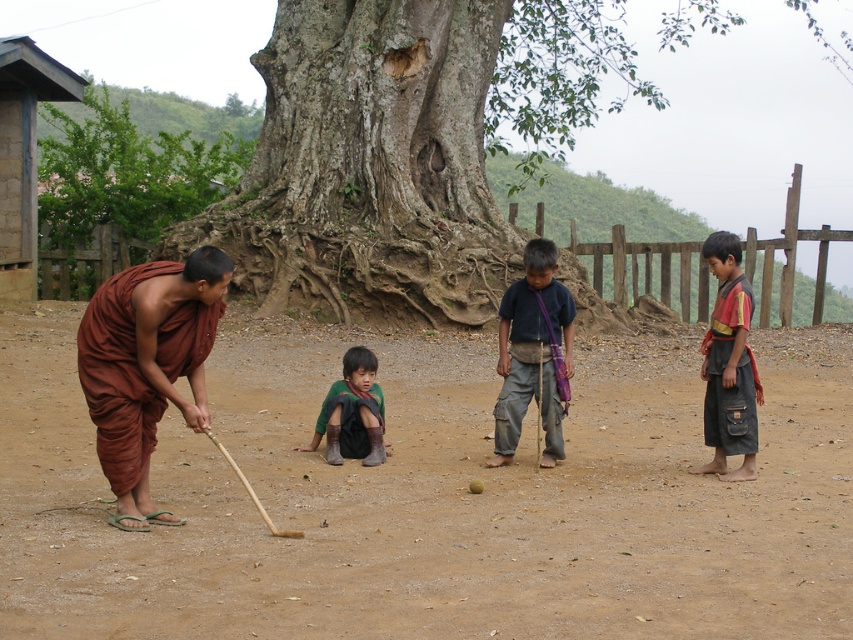
Question: Considering the real-world distances, which object is farthest from the green leafy tree at upper left?

Choices:
 (A) brown dirt field at center
 (B) dark green fabric at center

Answer: (B)

Question: Does green rough bark tree at center come in front of dark blue cotton shirt at center?

Choices:
 (A) yes
 (B) no

Answer: (B)

Question: Which is farther from the reddish-brown fabric pants at right?

Choices:
 (A) dark green fabric at center
 (B) green rough bark tree at center
 (C) brown dirt field at center
 (D) dark blue cotton shirt at center

Answer: (B)

Question: Is green rough bark tree at center to the left of dark blue cotton shirt at center from the viewer's perspective?

Choices:
 (A) yes
 (B) no

Answer: (B)

Question: Which of the following is the farthest from the observer?

Choices:
 (A) (361, 426)
 (B) (733, 307)

Answer: (A)

Question: Where is brown dirt field at center located in relation to green leafy tree at upper left in the image?

Choices:
 (A) above
 (B) below

Answer: (B)